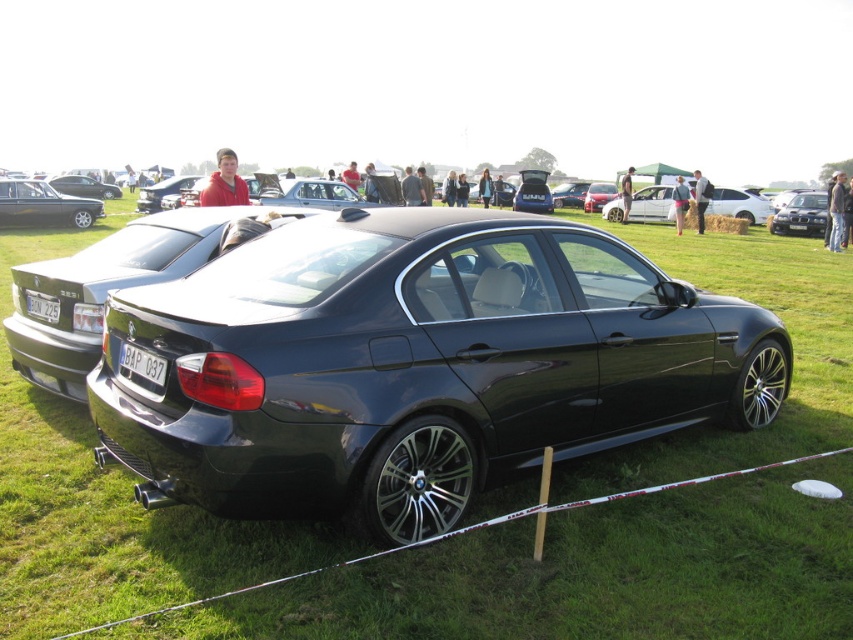
Question: Estimate the real-world distances between objects in this image. Which object is farther from the satin black sedan at center?

Choices:
 (A) metallic silver sedan at center
 (B) shiny black sedan at center
 (C) shiny metallic car at left

Answer: (B)

Question: Is shiny metallic car at left positioned behind black plastic license plate at center?

Choices:
 (A) no
 (B) yes

Answer: (B)

Question: Is metallic silver sedan at center to the right of satin black sedan at center from the viewer's perspective?

Choices:
 (A) yes
 (B) no

Answer: (B)

Question: Which point is closer to the camera?

Choices:
 (A) black plastic license plate at center
 (B) shiny metallic car at left
 (C) black plastic license plate at rear
 (D) shiny black sedan at center

Answer: (C)

Question: Can you confirm if green grass at center is positioned below black plastic license plate at center?

Choices:
 (A) no
 (B) yes

Answer: (A)

Question: Which of the following is the farthest from the observer?

Choices:
 (A) metallic silver sedan at center
 (B) green grass at center
 (C) satin black sedan at center
 (D) shiny black sedan at center

Answer: (D)